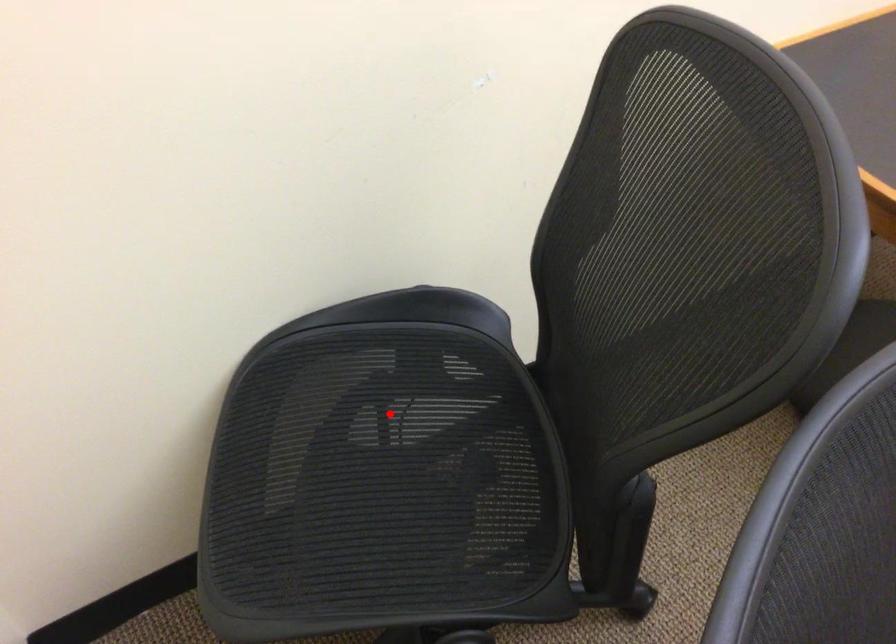
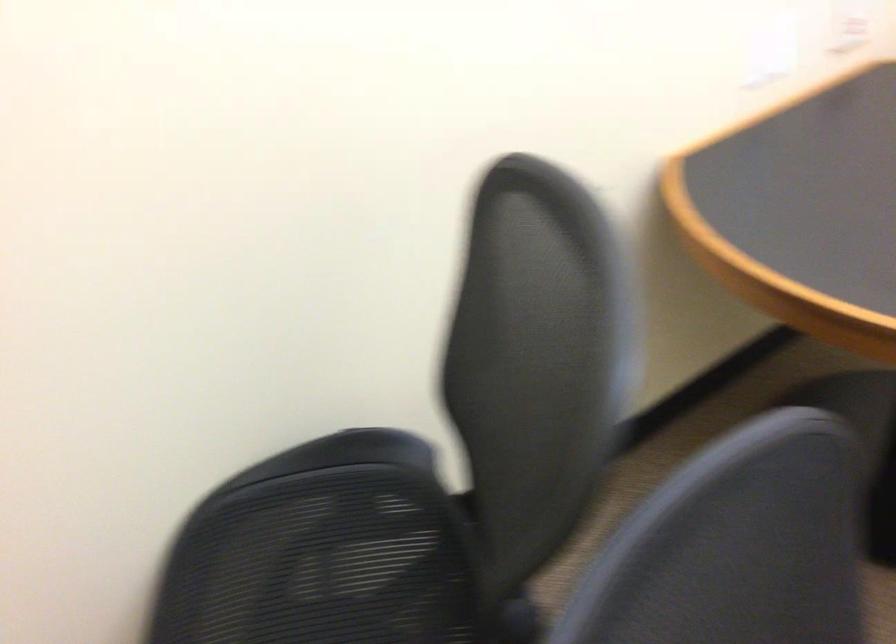
Find the pixel in the second image that matches the highlighted location in the first image.

(320, 565)